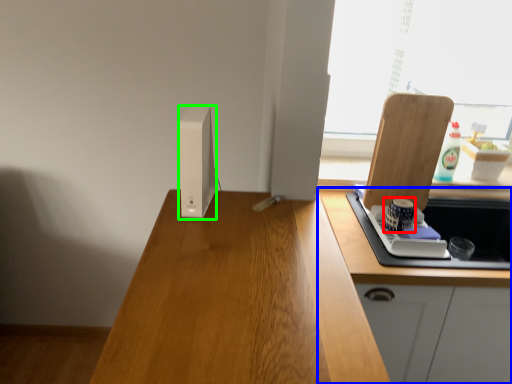
Question: Which is farther away from appliance (highlighted by a red box)? cabinetry (highlighted by a blue box) or appliance (highlighted by a green box)?

Choices:
 (A) cabinetry
 (B) appliance

Answer: (B)